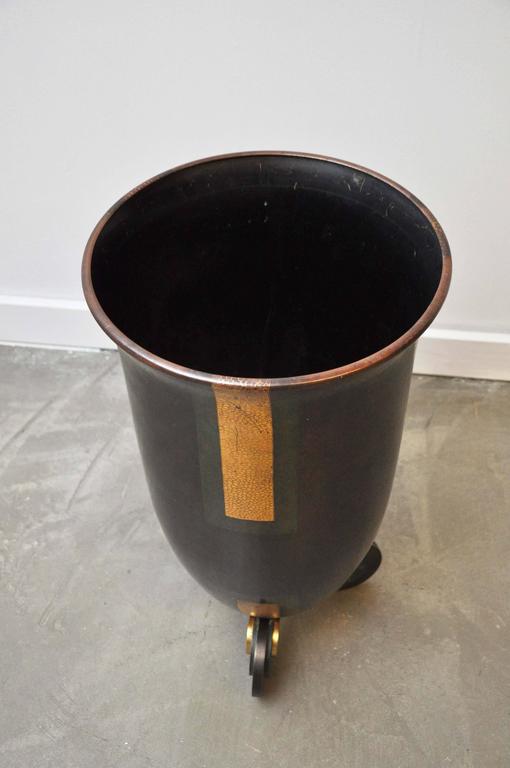
Identify the location of wall. The width and height of the screenshot is (510, 768). (60, 177).